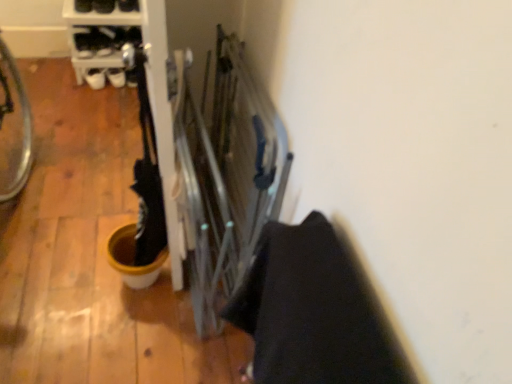
Question: From a real-world perspective, relative to black leather shoe at upper left, which is the 2th footwear from right to left, is black leather shoe at upper center, the second footwear when ordered from left to right, vertically above or below?

Choices:
 (A) above
 (B) below

Answer: (B)

Question: Is black leather shoe at upper center, the second footwear when ordered from left to right, situated inside black leather shoe at upper left, which is counted as the 1th footwear, starting from the left, or outside?

Choices:
 (A) outside
 (B) inside

Answer: (A)

Question: Is black leather shoe at upper center, the first footwear when ordered from right to left, bigger or smaller than black leather shoe at upper left, which is counted as the 1th footwear, starting from the left?

Choices:
 (A) small
 (B) big

Answer: (A)

Question: In terms of height, does black leather shoe at upper left, which is the 2th footwear from right to left, look taller or shorter compared to black leather shoe at upper center, the first footwear when ordered from right to left?

Choices:
 (A) short
 (B) tall

Answer: (B)

Question: Is black leather shoe at upper left, which is the 2th footwear from right to left, in front of or behind black leather shoe at upper center, the second footwear when ordered from left to right, in the image?

Choices:
 (A) front
 (B) behind

Answer: (A)

Question: Considering the positions of black leather shoe at upper left, which is counted as the 1th footwear, starting from the left, and black leather shoe at upper center, the second footwear when ordered from left to right, in the image, is black leather shoe at upper left, which is counted as the 1th footwear, starting from the left, bigger or smaller than black leather shoe at upper center, the second footwear when ordered from left to right,?

Choices:
 (A) small
 (B) big

Answer: (B)

Question: From a real-world perspective, relative to black leather shoe at upper center, the second footwear when ordered from left to right, is black leather shoe at upper left, which is counted as the 1th footwear, starting from the left, vertically above or below?

Choices:
 (A) above
 (B) below

Answer: (A)